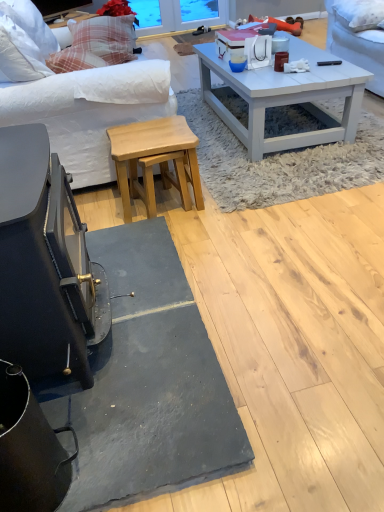
You are a GUI agent. You are given a task and a screenshot of the screen. Output one action in this format:
    pyautogui.click(x=<x>, y=<y>)
    Task: Click on the vacant area that is in front of matte blue cup at center, positioned as the 1th coffee cup in left-to-right order
    The image size is (384, 512).
    Given the screenshot: What is the action you would take?
    pyautogui.click(x=251, y=78)